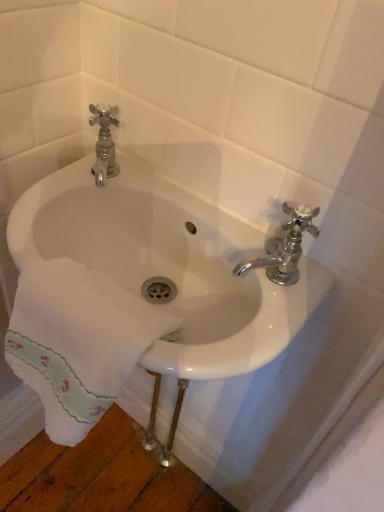
Question: Is chrome metallic faucet at upper right bigger than white embroidered towel at lower left?

Choices:
 (A) yes
 (B) no

Answer: (B)

Question: Considering the relative sizes of chrome metallic faucet at upper right and white embroidered towel at lower left in the image provided, is chrome metallic faucet at upper right taller than white embroidered towel at lower left?

Choices:
 (A) no
 (B) yes

Answer: (A)

Question: Does chrome metallic faucet at upper right have a lesser width compared to white embroidered towel at lower left?

Choices:
 (A) yes
 (B) no

Answer: (A)

Question: From a real-world perspective, does chrome metallic faucet at upper right stand above white embroidered towel at lower left?

Choices:
 (A) yes
 (B) no

Answer: (A)

Question: Is chrome metallic faucet at upper right completely or partially outside of white embroidered towel at lower left?

Choices:
 (A) no
 (B) yes

Answer: (B)

Question: From the image's perspective, does chrome metallic faucet at upper right appear lower than white embroidered towel at lower left?

Choices:
 (A) no
 (B) yes

Answer: (A)

Question: From the image's perspective, is white embroidered towel at lower left located beneath white ceramic sink at center?

Choices:
 (A) no
 (B) yes

Answer: (B)

Question: From a real-world perspective, is white embroidered towel at lower left beneath white ceramic sink at center?

Choices:
 (A) no
 (B) yes

Answer: (B)

Question: Considering the relative positions of white embroidered towel at lower left and white ceramic sink at center in the image provided, is white embroidered towel at lower left behind white ceramic sink at center?

Choices:
 (A) yes
 (B) no

Answer: (B)

Question: From a real-world perspective, is white embroidered towel at lower left on white ceramic sink at center?

Choices:
 (A) no
 (B) yes

Answer: (A)

Question: Does white embroidered towel at lower left have a lesser height compared to white ceramic sink at center?

Choices:
 (A) yes
 (B) no

Answer: (B)

Question: Is white embroidered towel at lower left not inside white ceramic sink at center?

Choices:
 (A) no
 (B) yes

Answer: (B)

Question: Is chrome metallic faucet at upper right facing towards white ceramic sink at center?

Choices:
 (A) yes
 (B) no

Answer: (B)